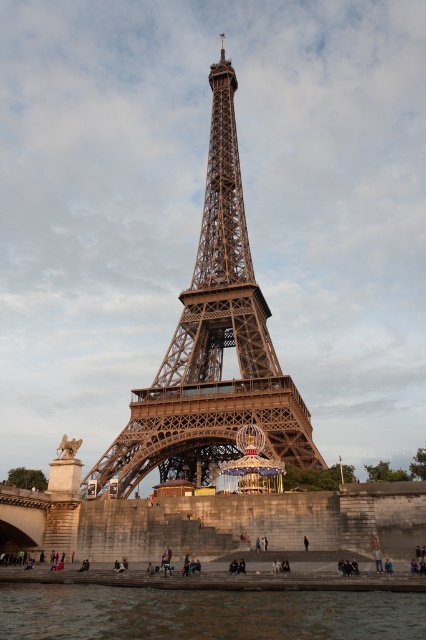
Question: Which point appears farthest from the camera in this image?

Choices:
 (A) (261, 605)
 (B) (103, 484)

Answer: (B)

Question: Is brown metal eiffel tower at center in front of smooth water at lower center?

Choices:
 (A) no
 (B) yes

Answer: (A)

Question: Is brown metal eiffel tower at center closer to camera compared to smooth water at lower center?

Choices:
 (A) no
 (B) yes

Answer: (A)

Question: Which object appears farthest from the camera in this image?

Choices:
 (A) smooth water at lower center
 (B) brown metal eiffel tower at center

Answer: (B)

Question: Can you confirm if brown metal eiffel tower at center is bigger than smooth water at lower center?

Choices:
 (A) no
 (B) yes

Answer: (B)